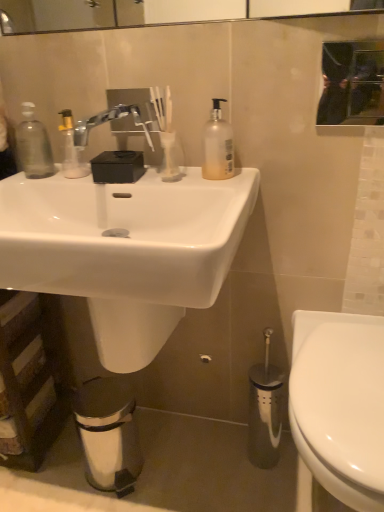
Where is `vacant point above white glossy toilet at lower right (from a real-world perspective)`? This screenshot has width=384, height=512. vacant point above white glossy toilet at lower right (from a real-world perspective) is located at coordinates (346, 371).